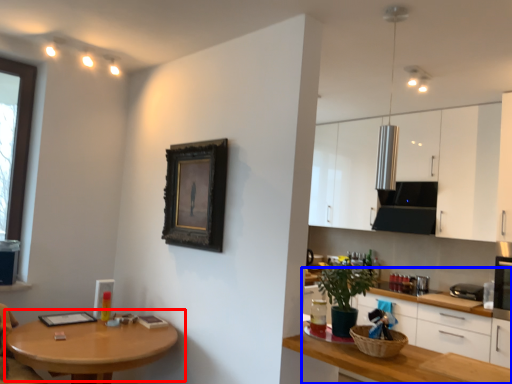
Question: Which object is closer to the camera taking this photo, table (highlighted by a red box) or cabinetry (highlighted by a blue box)?

Choices:
 (A) table
 (B) cabinetry

Answer: (A)